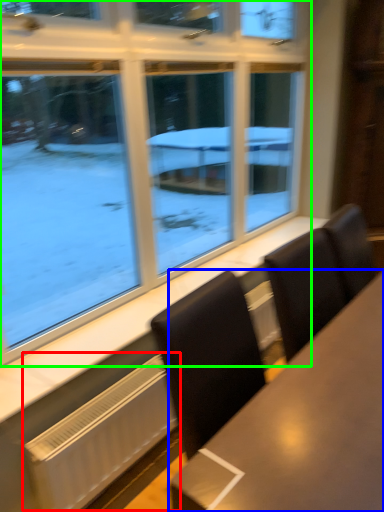
Question: Which object is positioned closest to radiator (highlighted by a red box)? Select from table (highlighted by a blue box) and window (highlighted by a green box).

Choices:
 (A) table
 (B) window

Answer: (A)